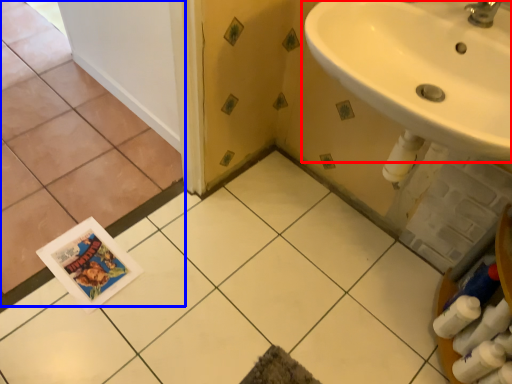
Question: Among these objects, which one is nearest to the camera, sink (highlighted by a red box) or ceramic tile (highlighted by a blue box)?

Choices:
 (A) sink
 (B) ceramic tile

Answer: (A)